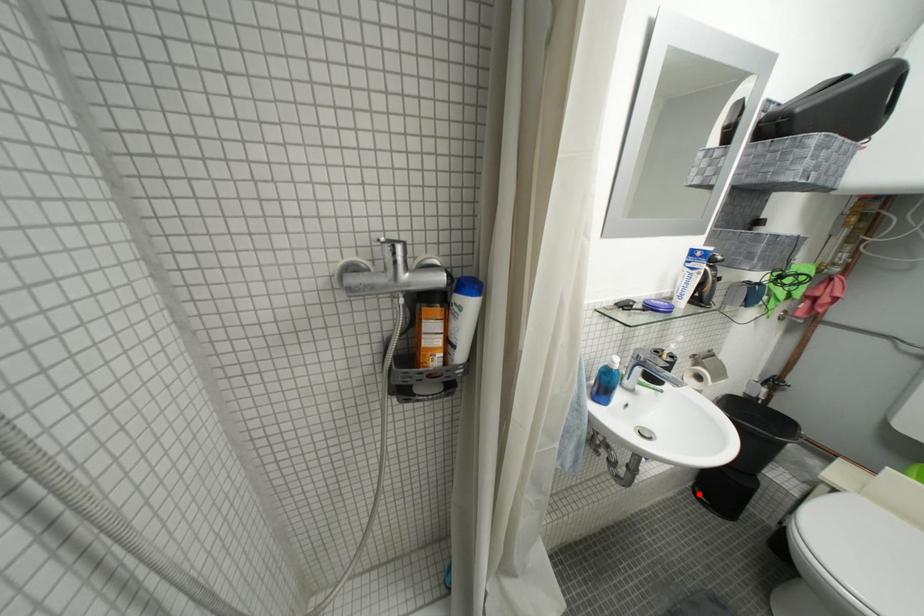
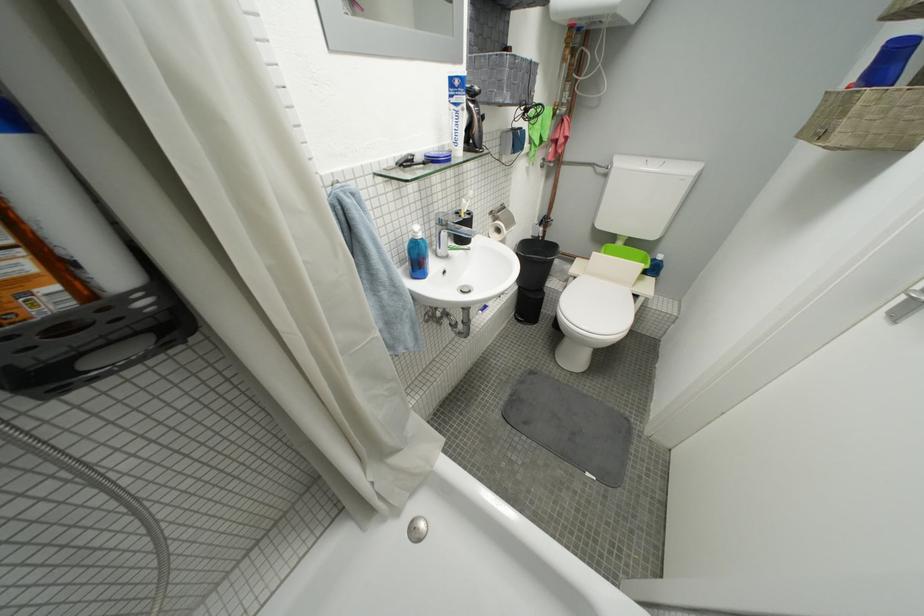
Locate, in the second image, the point that corresponds to the highlighted location in the first image.

(523, 322)